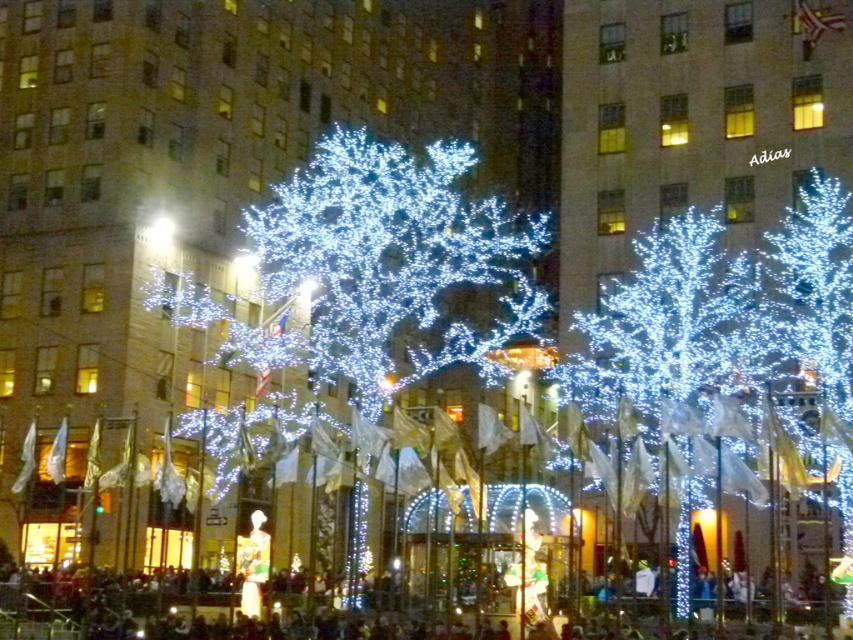
Is illuminated white tree at center to the left of illuminated plastic tree at right from the viewer's perspective?

Yes, illuminated white tree at center is to the left of illuminated plastic tree at right.

Looking at this image, between illuminated white tree at center and illuminated plastic tree at right, which one is positioned lower?

illuminated plastic tree at right is lower down.

Does point (364, 401) come closer to viewer compared to point (827, 250)?

No, it is behind (827, 250).

What are the coordinates of `illuminated white tree at center` in the screenshot? It's located at (386, 266).

How far apart are illuminated plastic tree at center and illuminated plastic tree at right?

illuminated plastic tree at center is 5.34 meters away from illuminated plastic tree at right.

Does illuminated plastic tree at center appear on the right side of illuminated plastic tree at right?

In fact, illuminated plastic tree at center is to the left of illuminated plastic tree at right.

What do you see at coordinates (682, 344) in the screenshot? The image size is (853, 640). I see `illuminated plastic tree at center` at bounding box center [682, 344].

Find the location of a particular element. illuminated plastic tree at center is located at coordinates (682, 344).

Can you confirm if illuminated white tree at center is thinner than illuminated plastic tree at center?

Incorrect, illuminated white tree at center's width is not less than illuminated plastic tree at center's.

From the picture: Can you confirm if illuminated white tree at center is wider than illuminated plastic tree at center?

Yes.

What do you see at coordinates (386, 266) in the screenshot?
I see `illuminated white tree at center` at bounding box center [386, 266].

The width and height of the screenshot is (853, 640). Identify the location of illuminated white tree at center. (386, 266).